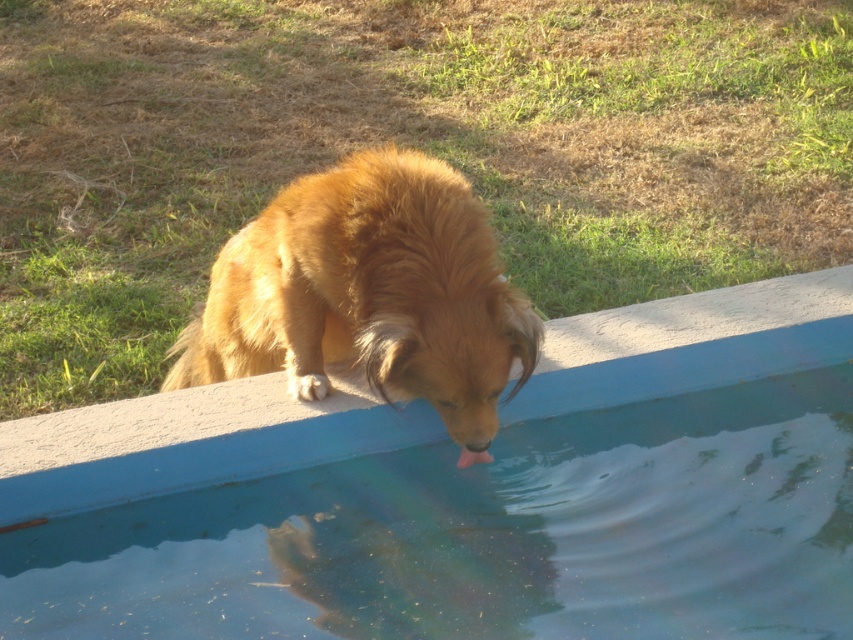
Question: Does blue concrete swimming pool at lower center have a lesser width compared to golden fur dog at lower center?

Choices:
 (A) no
 (B) yes

Answer: (A)

Question: Can you confirm if blue concrete swimming pool at lower center is positioned to the right of golden fur dog at lower center?

Choices:
 (A) no
 (B) yes

Answer: (B)

Question: Which of the following is the farthest from the observer?

Choices:
 (A) (763, 544)
 (B) (476, 342)

Answer: (A)

Question: Is the position of blue concrete swimming pool at lower center more distant than that of golden fur dog at lower center?

Choices:
 (A) no
 (B) yes

Answer: (A)

Question: Which point is closer to the camera taking this photo?

Choices:
 (A) pyautogui.click(x=376, y=266)
 (B) pyautogui.click(x=125, y=536)

Answer: (A)